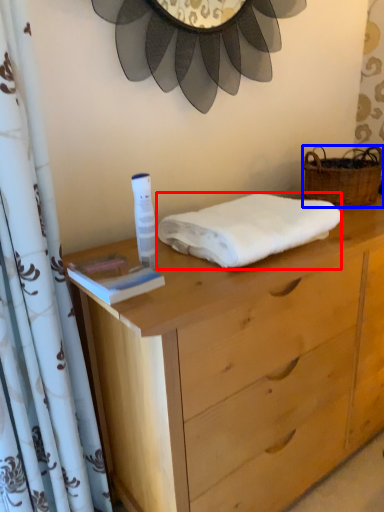
Question: Among these objects, which one is farthest to the camera, towel (highlighted by a red box) or picnic basket (highlighted by a blue box)?

Choices:
 (A) towel
 (B) picnic basket

Answer: (B)